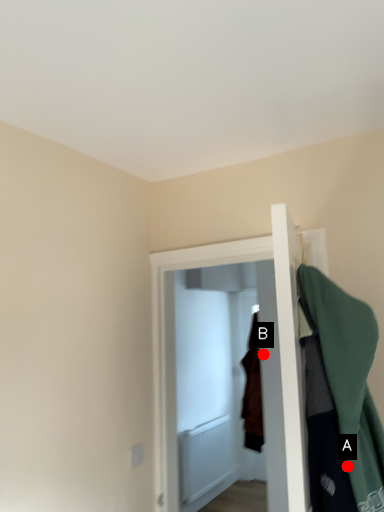
Question: Two points are circled on the image, labeled by A and B beside each circle. Which point is closer to the camera taking this photo?

Choices:
 (A) A is closer
 (B) B is closer

Answer: (A)